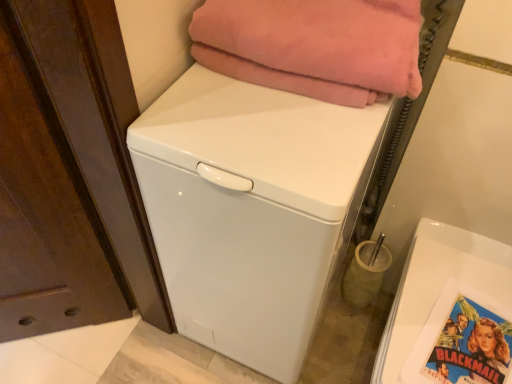
In order to click on free space to the back side of blue glossy comic book at lower right in this screenshot , I will do `click(453, 283)`.